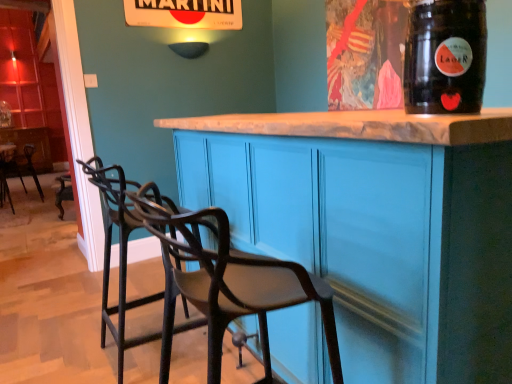
Question: Is transparent plastic straw at upper right wider or thinner than matte blue cabinet at center?

Choices:
 (A) wide
 (B) thin

Answer: (B)

Question: Based on their sizes in the image, would you say transparent plastic straw at upper right is bigger or smaller than matte blue cabinet at center?

Choices:
 (A) small
 (B) big

Answer: (A)

Question: Estimate the real-world distances between objects in this image. Which object is closer to the black metal bar stool at lower left, positioned as the second chair in back-to-front order?

Choices:
 (A) matte blue cabinet at center
 (B) black metal chair at left, which appears as the third chair when viewed from the right
 (C) matte black chair at center, which is counted as the 1th chair, starting from the right
 (D) transparent plastic straw at upper right
 (E) brushed metal table at left

Answer: (C)

Question: Considering the real-world distances, which object is closest to the transparent plastic straw at upper right?

Choices:
 (A) black metal bar stool at lower left, which is the second chair in right-to-left order
 (B) matte black chair at center, marked as the third chair in a left-to-right arrangement
 (C) black metal chair at left, which is the 1th chair in back-to-front order
 (D) brushed metal table at left
 (E) matte blue cabinet at center

Answer: (E)